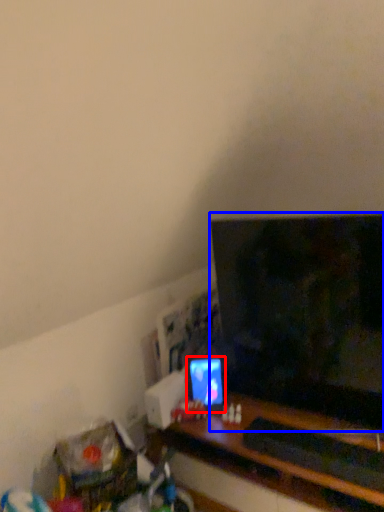
Question: Which object is closer to the camera taking this photo, computer monitor (highlighted by a red box) or television (highlighted by a blue box)?

Choices:
 (A) computer monitor
 (B) television

Answer: (B)